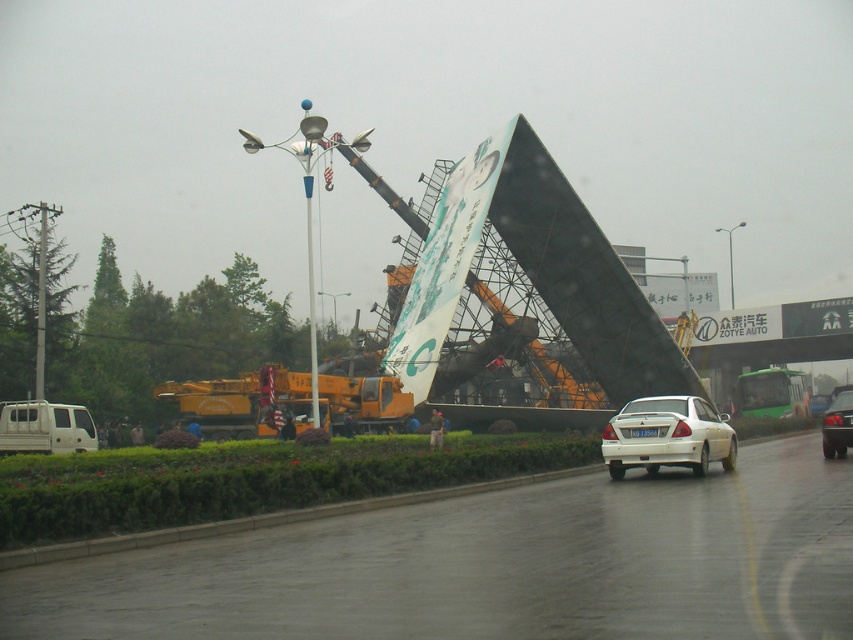
Is white matte van at lower left closer to the viewer compared to shiny silver sedan at center?

That is False.

Looking at this image, measure the distance between white matte van at lower left and camera.

white matte van at lower left and camera are 30.56 meters apart from each other.

Identify the location of white matte van at lower left. The width and height of the screenshot is (853, 640). (45, 428).

Which is more to the left, black asphalt road at center or white matte van at lower left?

From the viewer's perspective, white matte van at lower left appears more on the left side.

Which is behind, point (579, 625) or point (77, 445)?

The point (77, 445) is behind.

Locate an element on the screen. Image resolution: width=853 pixels, height=640 pixels. black asphalt road at center is located at coordinates (495, 564).

Is point (792, 620) farther from viewer compared to point (650, 419)?

That is False.

Which is behind, point (20, 609) or point (712, 433)?

Point (712, 433)

Who is more distant from viewer, (759, 481) or (676, 410)?

The point (676, 410) is more distant.

This screenshot has height=640, width=853. I want to click on black asphalt road at center, so click(x=495, y=564).